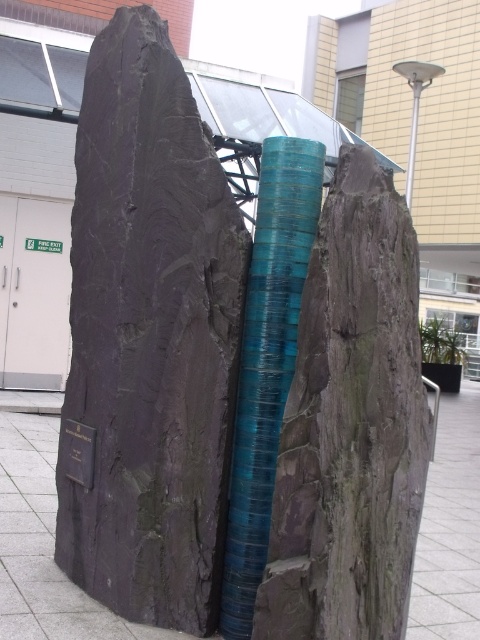
Question: Which point is closer to the camera?

Choices:
 (A) rough stone boulder at center
 (B) metallic pole at upper right

Answer: (A)

Question: Can you confirm if rough stone boulder at center is positioned to the left of teal glossy tube at center?

Choices:
 (A) no
 (B) yes

Answer: (A)

Question: Which of these objects is positioned farthest from the metallic pole at upper right?

Choices:
 (A) teal glossy tube at center
 (B) rough stone boulder at center

Answer: (A)

Question: Does teal glossy tube at center have a smaller size compared to metallic pole at upper right?

Choices:
 (A) yes
 (B) no

Answer: (A)

Question: Which point is farther to the camera?

Choices:
 (A) rough stone boulder at center
 (B) teal glossy tube at center
 (C) metallic pole at upper right

Answer: (B)

Question: Can you confirm if teal glossy tube at center is positioned to the right of metallic pole at upper right?

Choices:
 (A) yes
 (B) no

Answer: (B)